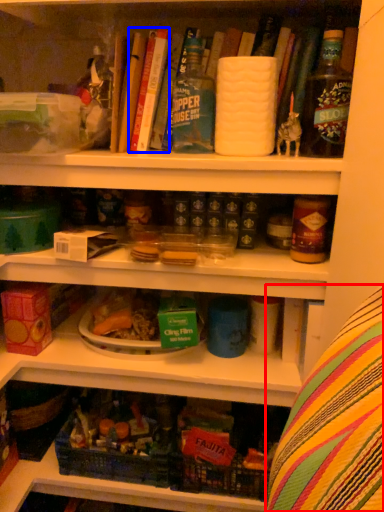
Question: Which object appears closest to the camera in this image, leftover (highlighted by a red box) or book (highlighted by a blue box)?

Choices:
 (A) leftover
 (B) book

Answer: (A)